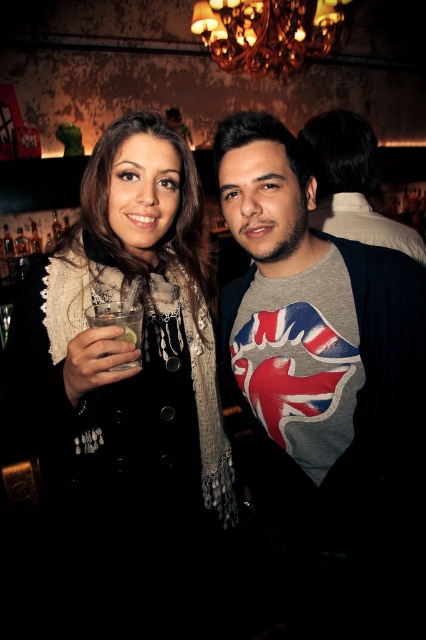
Question: Is gray fabric shirt at center bigger than matte black coat at center?

Choices:
 (A) yes
 (B) no

Answer: (B)

Question: Is gray fabric shirt at center further to the viewer compared to matte black coat at center?

Choices:
 (A) no
 (B) yes

Answer: (B)

Question: Which point appears closest to the camera in this image?

Choices:
 (A) [x=92, y=410]
 (B) [x=282, y=253]
 (C) [x=135, y=365]

Answer: (C)

Question: Estimate the real-world distances between objects in this image. Which object is closer to the matte black coat at center?

Choices:
 (A) clear glass at left
 (B) gray fabric shirt at center

Answer: (B)

Question: Which point is closer to the camera?

Choices:
 (A) click(x=69, y=259)
 (B) click(x=115, y=301)
 (C) click(x=403, y=545)

Answer: (B)

Question: Can you confirm if matte black coat at center is wider than clear glass at left?

Choices:
 (A) yes
 (B) no

Answer: (A)